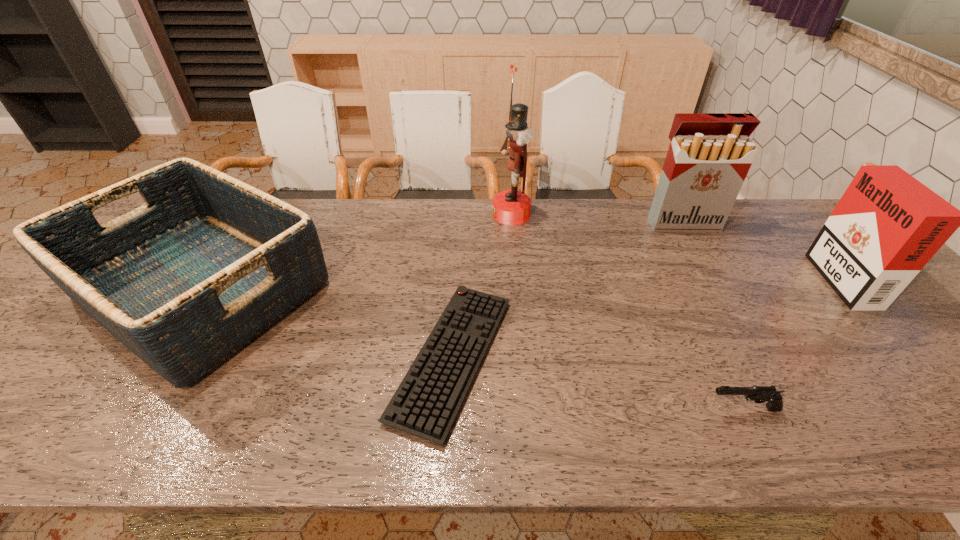
The height and width of the screenshot is (540, 960). I want to click on nutcracker, so click(x=511, y=207).

Identify the location of the left cigarette case. The height and width of the screenshot is (540, 960). (710, 154).

Identify the location of the rightmost object. This screenshot has height=540, width=960. (886, 227).

This screenshot has width=960, height=540. Find the location of `the fourth shortest object`. the fourth shortest object is located at coordinates (886, 227).

Locate an element on the screen. the fifth tallest object is located at coordinates (759, 394).

Identify the location of the shortest object. Image resolution: width=960 pixels, height=540 pixels. (426, 403).

What are the coordinates of `vacant space located on the front-facing side of the tallest object` in the screenshot? It's located at (389, 214).

Identify the location of vacant point located 0.070m on the front-facing side of the tallest object. This screenshot has height=540, width=960. (470, 214).

Identify the location of blank area located 0.330m on the front-facing side of the tallest object. (389, 214).

I want to click on free region located 0.080m with the lid open on the farther cigarette case, so click(697, 249).